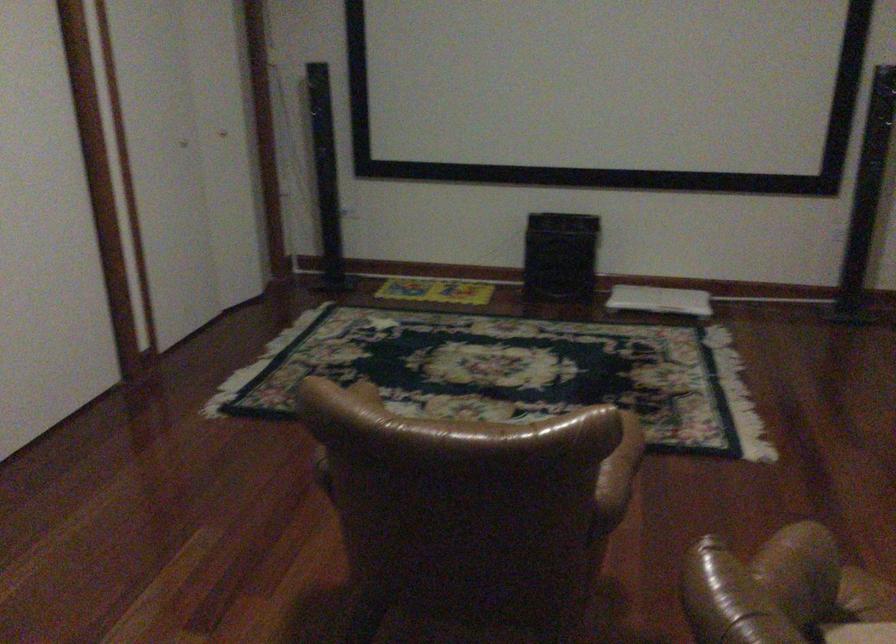
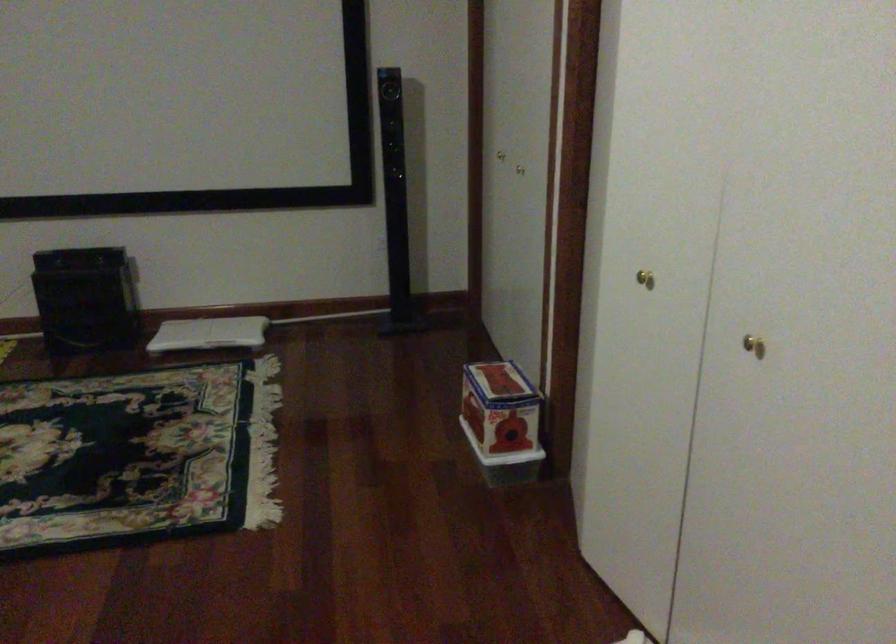
Locate, in the second image, the point that corresponds to point (668, 298) in the first image.

(209, 333)